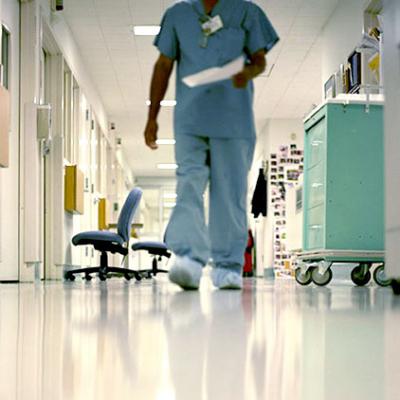
Find the location of a particular element. The width and height of the screenshot is (400, 400). fluorescent ceiling light is located at coordinates (147, 33), (170, 103), (166, 143), (166, 166).